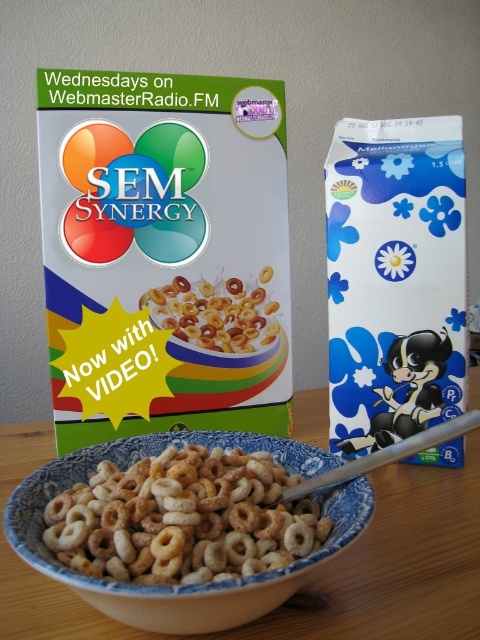
You are setting up a breakfast table and have a matte cardboard cereal box at center and golden matte cereal rings at center. Which object takes up more space on the table?

The matte cardboard cereal box at center is bigger than the golden matte cereal rings at center, so it takes up more space on the table.

You are setting up a breakfast table and want to place a decorative plate between the blue glossy milk carton at right and the blue ceramic bowl at center. Can the plate fit between them if the plate is 10 cm wide?

The blue glossy milk carton at right is narrower than the blue ceramic bowl at center. However, without knowing the exact distance between them, we cannot determine if the 10 cm plate will fit. Please measure the space between the blue glossy milk carton at right and the blue ceramic bowl at center first.